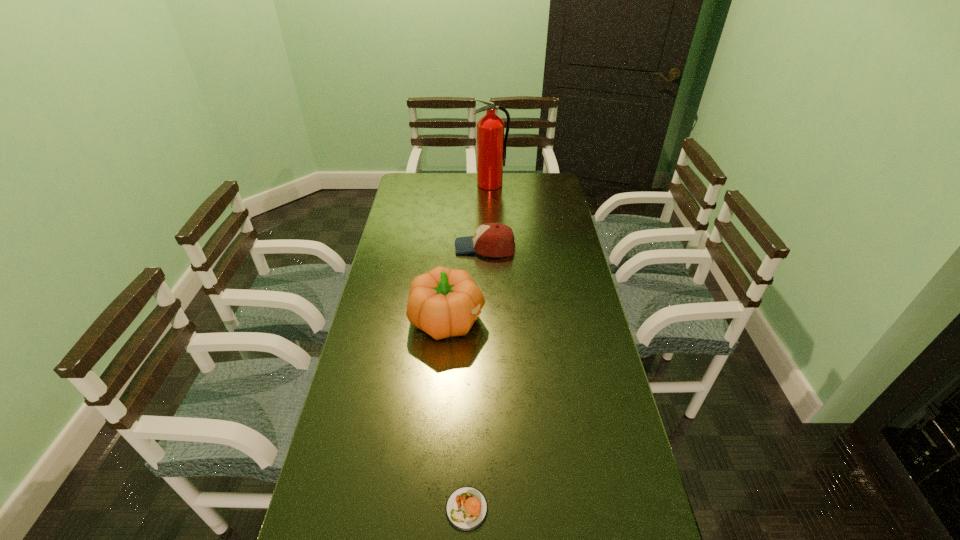
The width and height of the screenshot is (960, 540). I want to click on vacant region between the pumpkin and the patty, so click(457, 414).

What are the coordinates of `free spot between the second shortest object and the farthest object` in the screenshot? It's located at (488, 216).

You are a GUI agent. You are given a task and a screenshot of the screen. Output one action in this format:
    pyautogui.click(x=<x>, y=<y>)
    Task: Click on the empty space between the second nearest object and the nearest object
    
    Given the screenshot: What is the action you would take?
    pyautogui.click(x=457, y=414)

Where is `free point between the nearest object and the farthest object`? The height and width of the screenshot is (540, 960). free point between the nearest object and the farthest object is located at coordinates (479, 346).

You are a GUI agent. You are given a task and a screenshot of the screen. Output one action in this format:
    pyautogui.click(x=<x>, y=<y>)
    Task: Click on the empty space that is in between the third nearest object and the patty
    The width and height of the screenshot is (960, 540).
    Given the screenshot: What is the action you would take?
    pyautogui.click(x=476, y=378)

I want to click on free space between the nearest object and the pumpkin, so click(457, 414).

Choose which object is the second nearest neighbor to the patty. Please provide its 2D coordinates. Your answer should be formatted as a tuple, i.e. [(x, y)], where the tuple contains the x and y coordinates of a point satisfying the conditions above.

[(490, 239)]

Where is `object that ranks as the third closest to the pumpkin`? The width and height of the screenshot is (960, 540). object that ranks as the third closest to the pumpkin is located at coordinates (491, 145).

Where is `vacant area that satisfies the following two spatial constraints: 1. on the carved face of the second nearest object; 2. on the right side of the nearest object`? This screenshot has width=960, height=540. vacant area that satisfies the following two spatial constraints: 1. on the carved face of the second nearest object; 2. on the right side of the nearest object is located at coordinates (433, 509).

Where is `free location that satisfies the following two spatial constraints: 1. on the carved face of the patty; 2. on the right side of the pumpkin`? The image size is (960, 540). free location that satisfies the following two spatial constraints: 1. on the carved face of the patty; 2. on the right side of the pumpkin is located at coordinates (433, 509).